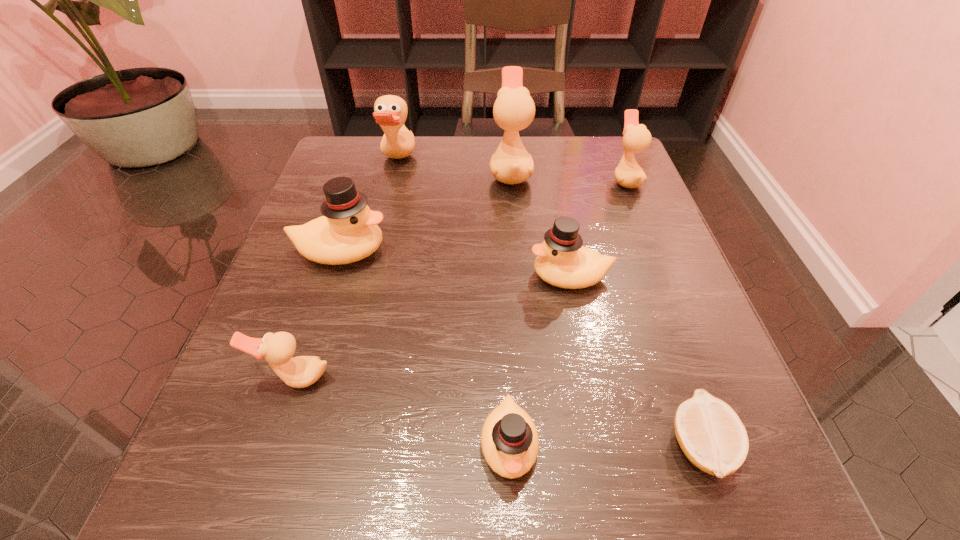
The height and width of the screenshot is (540, 960). In order to click on free location that satisfies the following two spatial constraints: 1. on the beak of the lemon; 2. on the right side of the third tan duck from left to right in this screenshot , I will do `click(534, 446)`.

Image resolution: width=960 pixels, height=540 pixels. I want to click on vacant position in the image that satisfies the following two spatial constraints: 1. on the front-facing side of the rightmost yellow duck; 2. on the front-facing side of the second yellow duck from right to left, so click(x=603, y=444).

Image resolution: width=960 pixels, height=540 pixels. I want to click on free point that satisfies the following two spatial constraints: 1. on the beak of the shortest object; 2. on the right side of the second biggest tan duck, so click(x=329, y=446).

Identify the location of free spot that satisfies the following two spatial constraints: 1. on the beak of the second smallest tan duck; 2. on the front-facing side of the nearest yellow duck. (732, 444).